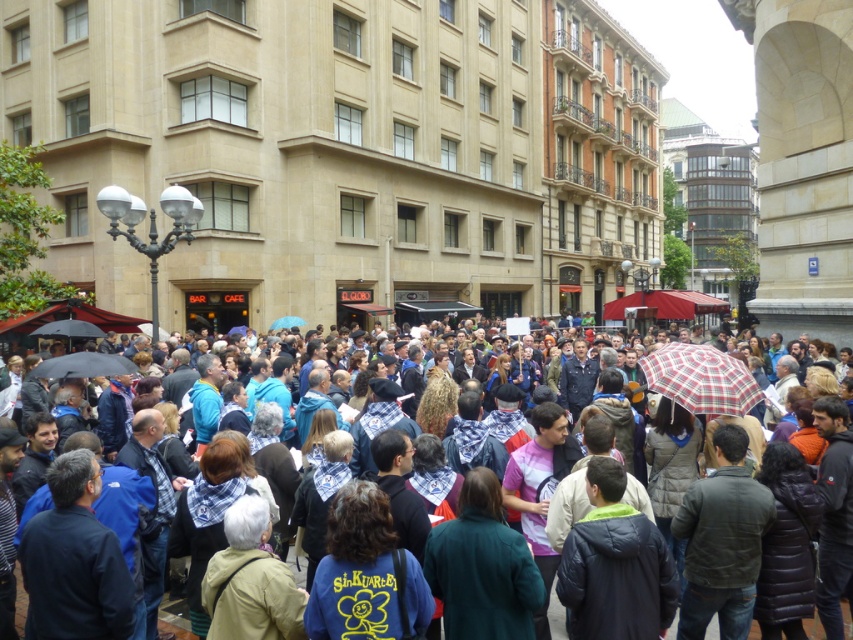
Question: Can you confirm if plaid fabric umbrella at center is positioned to the right of black matte umbrella at center?

Choices:
 (A) no
 (B) yes

Answer: (B)

Question: Does plaid fabric umbrella at center have a larger size compared to black matte umbrella at center?

Choices:
 (A) no
 (B) yes

Answer: (B)

Question: Which object is closer to the camera taking this photo?

Choices:
 (A) plaid fabric umbrella at center
 (B) black matte umbrella at center
 (C) blue fabric umbrella at center
 (D) multicolored fabric bandanas at center

Answer: (D)

Question: Does black matte umbrella at center lie behind black matte umbrella at lower left?

Choices:
 (A) no
 (B) yes

Answer: (A)

Question: Which of the following is the farthest from the observer?

Choices:
 (A) plaid fabric umbrella at center
 (B) black matte umbrella at lower left

Answer: (B)

Question: Which point appears closest to the camera in this image?

Choices:
 (A) (53, 332)
 (B) (22, 630)
 (C) (84, 368)

Answer: (B)